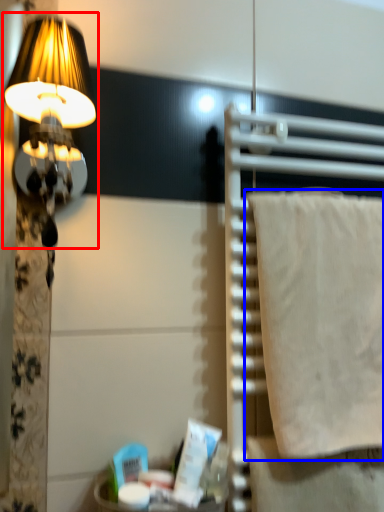
Question: Which point is further to the camera, lamp (highlighted by a red box) or wrap (highlighted by a blue box)?

Choices:
 (A) lamp
 (B) wrap

Answer: (B)